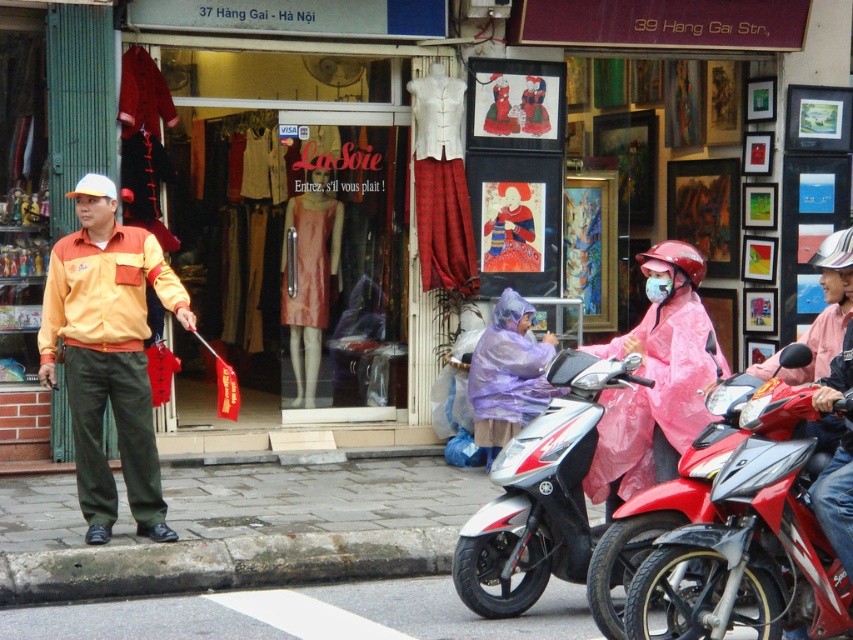
Question: In this image, where is orange fabric shirt at left located relative to white glossy scooter at center?

Choices:
 (A) left
 (B) right

Answer: (A)

Question: Can you confirm if orange fabric shirt at left is positioned below red glossy motorcycle at right?

Choices:
 (A) no
 (B) yes

Answer: (A)

Question: Estimate the real-world distances between objects in this image. Which object is farther from the white glossy scooter at center?

Choices:
 (A) orange fabric shirt at left
 (B) purple matte raincoat at center
 (C) red glossy motorcycle at right
 (D) matte pink dress at center

Answer: (D)

Question: Which point is closer to the camera taking this photo?

Choices:
 (A) (86, 340)
 (B) (479, 426)
 (C) (576, 474)

Answer: (C)

Question: Based on their relative distances, which object is farther from the white glossy scooter at center?

Choices:
 (A) orange fabric shirt at left
 (B) red glossy motorcycle at right
 (C) matte pink dress at center
 (D) purple matte raincoat at center

Answer: (C)

Question: Does white glossy scooter at center come in front of purple matte raincoat at center?

Choices:
 (A) yes
 (B) no

Answer: (A)